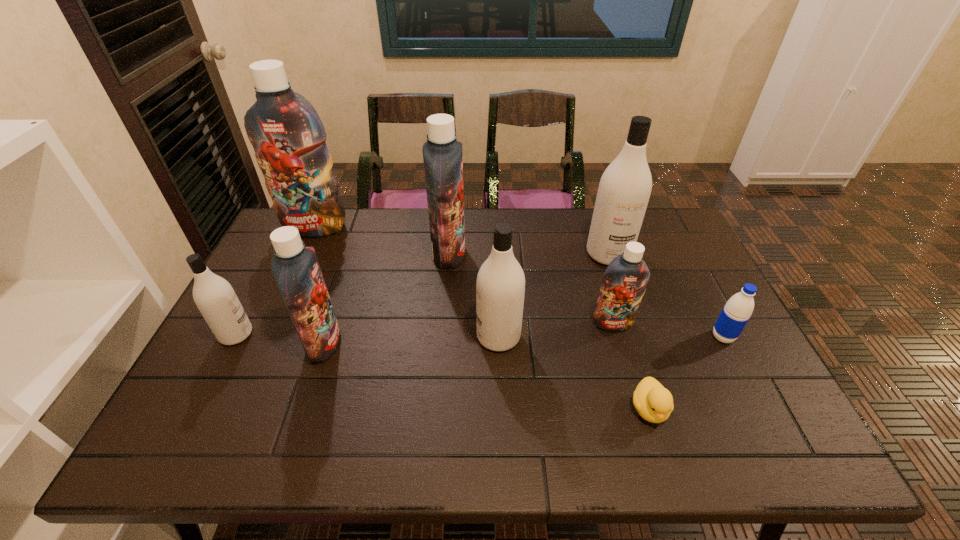
At what (x,y) coordinates should I click in order to perform the action: click on the biggest blue shampoo. Please return your answer as a coordinate pair (x, y). Looking at the image, I should click on (289, 139).

Where is `the tallest shampoo`? Image resolution: width=960 pixels, height=540 pixels. the tallest shampoo is located at coordinates (289, 139).

Find the location of a particular element. the sixth object from right to left is located at coordinates (442, 154).

At what (x,y) coordinates should I click in order to perform the action: click on the third smallest blue shampoo. Please return your answer as a coordinate pair (x, y). The height and width of the screenshot is (540, 960). Looking at the image, I should click on (442, 154).

The width and height of the screenshot is (960, 540). Find the location of `the farthest white shampoo`. the farthest white shampoo is located at coordinates (624, 190).

Locate an element on the screen. The width and height of the screenshot is (960, 540). the biggest white shampoo is located at coordinates (624, 190).

This screenshot has width=960, height=540. I want to click on the second blue shampoo from left to right, so click(296, 269).

The width and height of the screenshot is (960, 540). In order to click on the seventh object from right to left in this screenshot , I will do `click(296, 269)`.

Find the location of a particular element. the third shampoo from right to left is located at coordinates (500, 285).

At what (x,y) coordinates should I click in order to perform the action: click on the second smallest white shampoo. Please return your answer as a coordinate pair (x, y). Image resolution: width=960 pixels, height=540 pixels. Looking at the image, I should click on (500, 285).